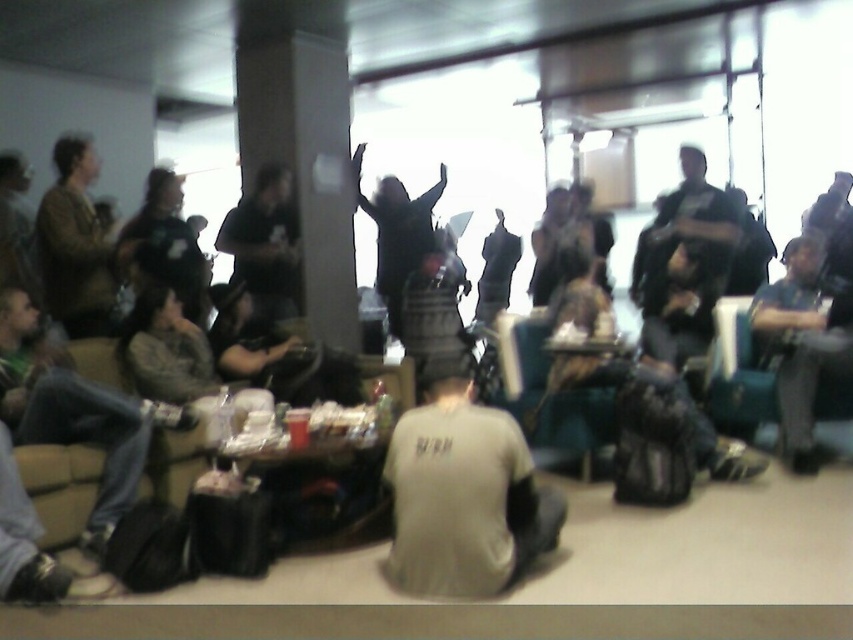
You are a guest at the gathering and want to sit in the teal fabric armchair at center. Is the dark gray fabric jacket at right currently occupying that seat?

The dark gray fabric jacket at right is positioned over the teal fabric armchair at center, which means the jacket is placed on the armchair. Therefore, the teal fabric armchair at center is currently occupied by the dark gray fabric jacket at right, so you cannot sit there without moving the jacket.

You are a guest at this indoor gathering and want to pick up your dark gray fabric jacket. You see both the dark gray fabric jacket at lower left and the dark gray fabric jacket at right. Which one is closer to the ground?

The dark gray fabric jacket at lower left is located below dark gray fabric jacket at right, so it is closer to the ground.